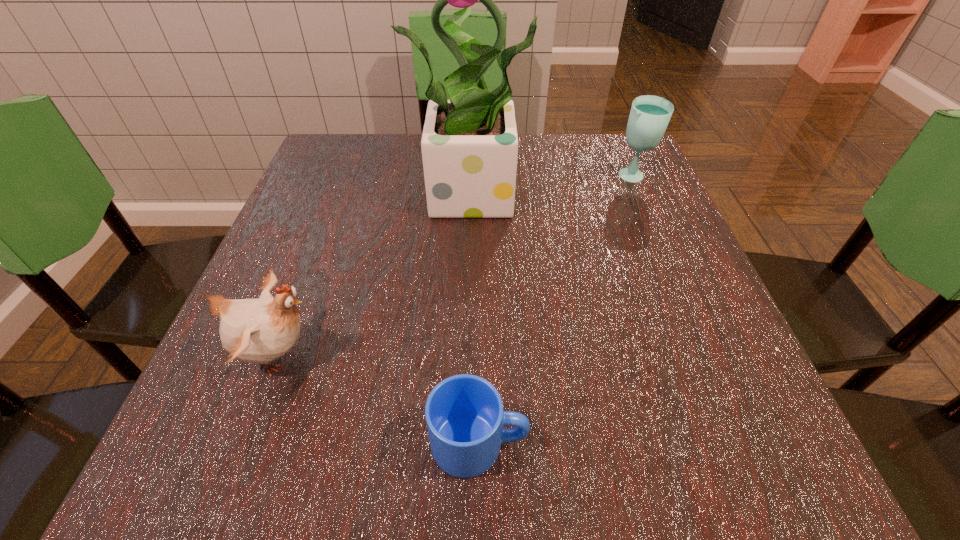
Identify which object is located as the second nearest to the bird. Please provide its 2D coordinates. Your answer should be formatted as a tuple, i.e. [(x, y)], where the tuple contains the x and y coordinates of a point satisfying the conditions above.

[(469, 144)]

Image resolution: width=960 pixels, height=540 pixels. Find the location of `object identified as the closest to the rightmost object`. object identified as the closest to the rightmost object is located at coordinates (469, 144).

Where is `vacant area that satisfies the following two spatial constraints: 1. on the front-facing side of the tallest object; 2. at the beak of the leftmost object`? This screenshot has width=960, height=540. vacant area that satisfies the following two spatial constraints: 1. on the front-facing side of the tallest object; 2. at the beak of the leftmost object is located at coordinates (481, 355).

Where is `vacant region that satisfies the following two spatial constraints: 1. on the front-facing side of the flower arrangement; 2. at the beak of the bird`? This screenshot has height=540, width=960. vacant region that satisfies the following two spatial constraints: 1. on the front-facing side of the flower arrangement; 2. at the beak of the bird is located at coordinates (481, 355).

You are a GUI agent. You are given a task and a screenshot of the screen. Output one action in this format:
    pyautogui.click(x=<x>, y=<y>)
    Task: Click on the vacant space that satisfies the following two spatial constraints: 1. on the front-facing side of the flower arrangement; 2. on the side of the shortest object with the handle
    
    Given the screenshot: What is the action you would take?
    pyautogui.click(x=481, y=443)

Identify the location of vacant space that satisfies the following two spatial constraints: 1. on the front-facing side of the tallest object; 2. on the side of the mug with the handle. (x=481, y=443).

Find the location of a particular element. free location that satisfies the following two spatial constraints: 1. on the front side of the glass; 2. at the beak of the bird is located at coordinates (708, 355).

I want to click on vacant region that satisfies the following two spatial constraints: 1. on the front-facing side of the flower arrangement; 2. on the side of the mug with the handle, so [481, 443].

The image size is (960, 540). I want to click on vacant space that satisfies the following two spatial constraints: 1. on the front-facing side of the flower arrangement; 2. on the side of the shortest object with the handle, so click(481, 443).